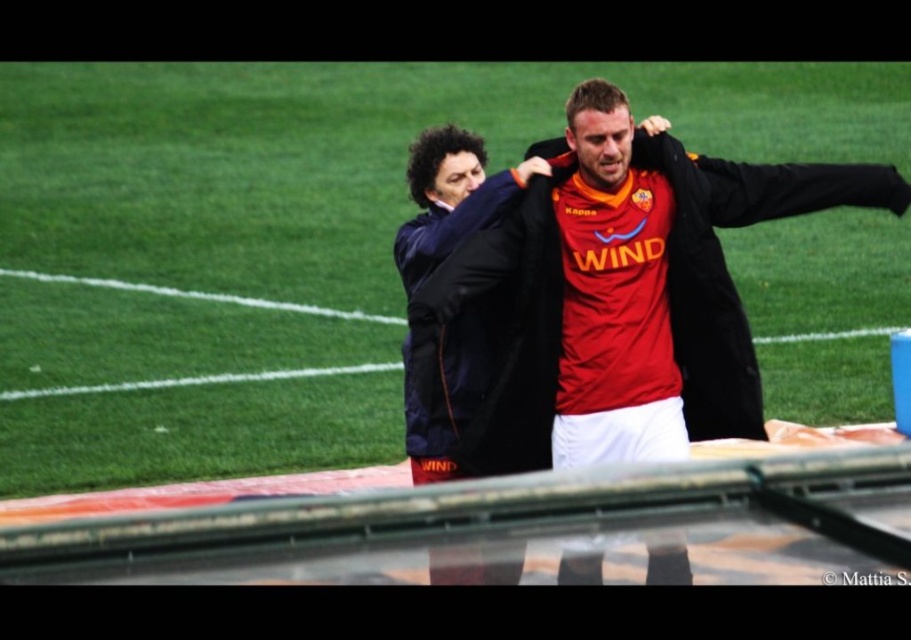
You are a drone operator trying to capture the best aerial shot of the soccer game. You need to ensure the camera focuses on the green grass football field at center. Given that the field is represented by the point at coordinates (288,240), what should you adjust in your camera settings to prioritize this area?

To prioritize focusing on the green grass football field at center located at point (288,240), adjust the camera focus to this coordinate point.

You are a photographer trying to capture a wide shot of the green grass football field at center and the matte black jacket at center. Given that your camera has a limited focus range, which object should you prioritize focusing on to ensure it appears sharp in the photo?

The green grass football field at center is larger in size than the matte black jacket at center, so you should prioritize focusing on the green grass football field at center to ensure it appears sharp in the photo.